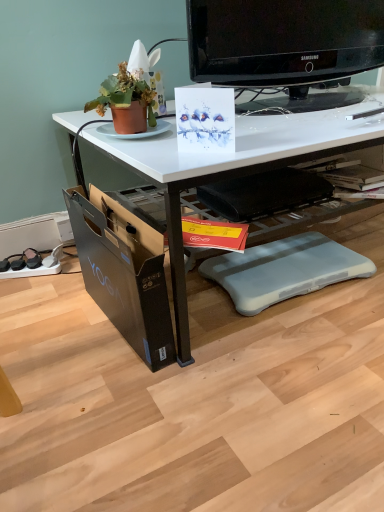
Where is `free space above gray plastic swivel chair at lower center, the 1th swivel chair from the bottom (from a real-world perspective)`? The width and height of the screenshot is (384, 512). free space above gray plastic swivel chair at lower center, the 1th swivel chair from the bottom (from a real-world perspective) is located at coordinates (289, 261).